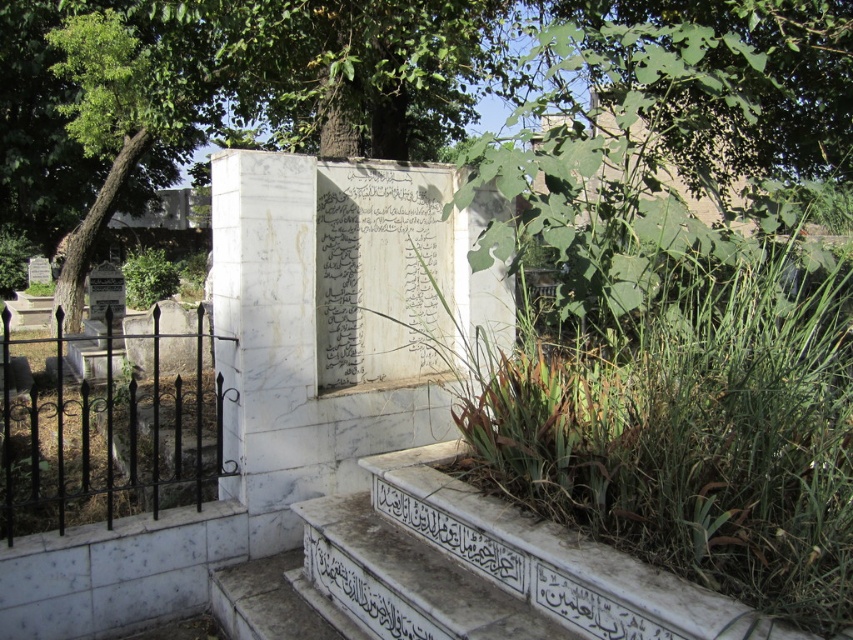
Question: Does black wrought iron fence at left have a lesser width compared to green leafy tree at upper left?

Choices:
 (A) yes
 (B) no

Answer: (A)

Question: Which of the following is the farthest from the observer?

Choices:
 (A) black wrought iron fence at left
 (B) black stone inscription at lower center

Answer: (A)

Question: Can you confirm if black wrought iron fence at left is positioned to the right of black stone inscription at lower center?

Choices:
 (A) yes
 (B) no

Answer: (B)

Question: Does black wrought iron fence at left lie in front of green leafy tree at upper left?

Choices:
 (A) yes
 (B) no

Answer: (A)

Question: Considering the real-world distances, which object is farthest from the green leafy tree at upper left?

Choices:
 (A) black stone inscription at lower center
 (B) black wrought iron fence at left

Answer: (A)

Question: Which of the following is the closest to the observer?

Choices:
 (A) black stone inscription at lower center
 (B) black wrought iron fence at left

Answer: (A)